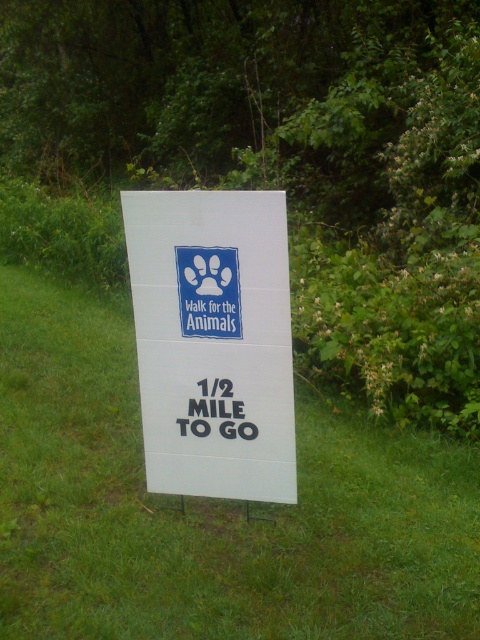
Between green grass at center and white cardboard sign at center, which one has more height?

white cardboard sign at center is taller.

Does green grass at center appear over white cardboard sign at center?

No.

Image resolution: width=480 pixels, height=640 pixels. What are the coordinates of `green grass at center` in the screenshot? It's located at (210, 508).

Identify the location of green grass at center. The height and width of the screenshot is (640, 480). (210, 508).